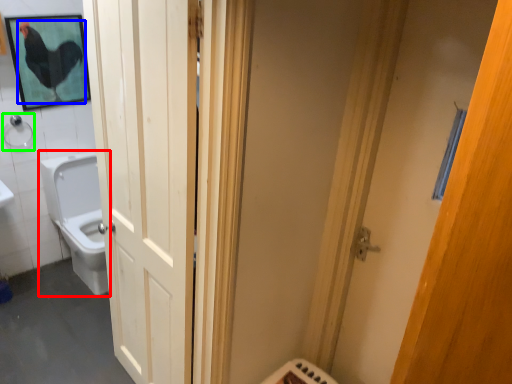
Question: Considering the real-world distances, which object is closest to toilet (highlighted by a red box)? chicken (highlighted by a blue box) or shower (highlighted by a green box).

Choices:
 (A) chicken
 (B) shower

Answer: (B)